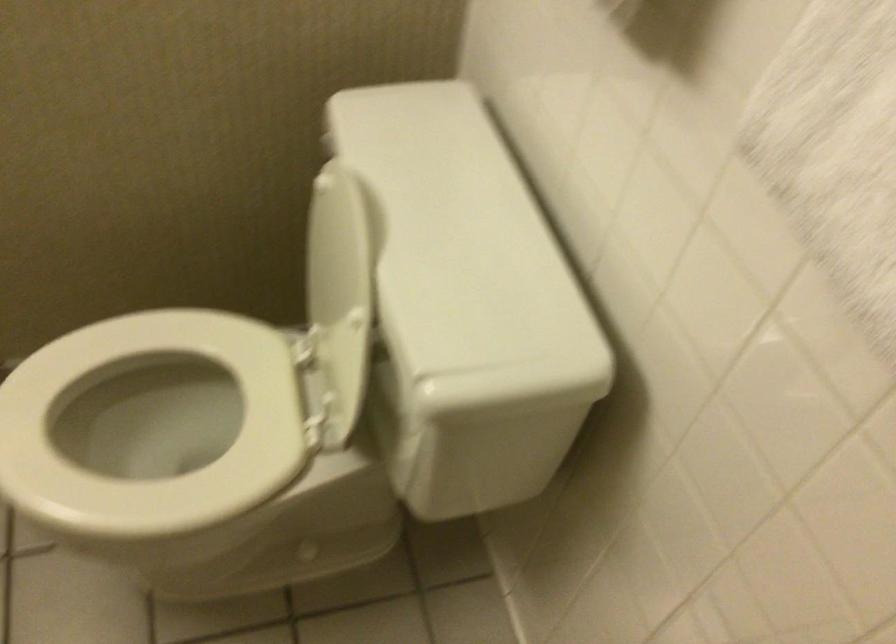
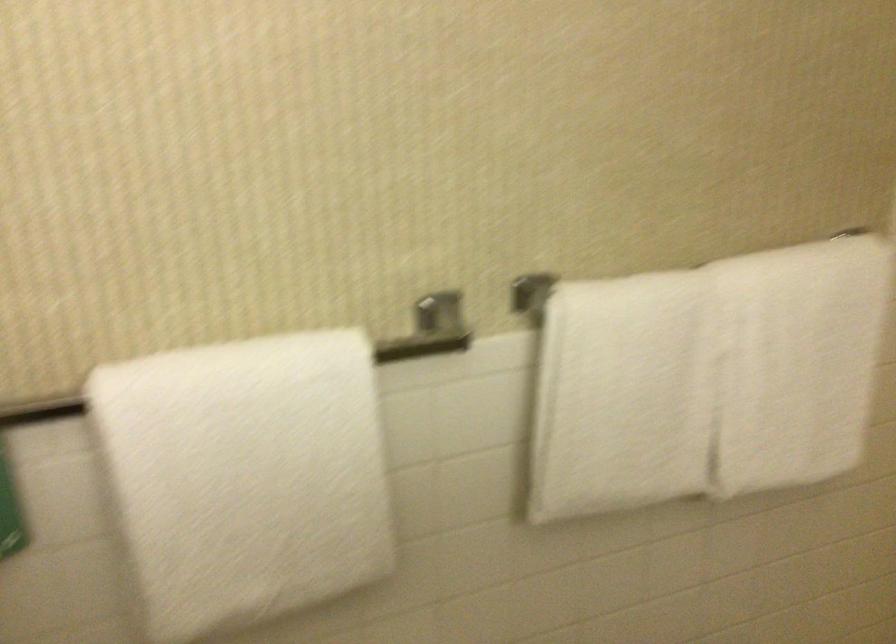
Based on the continuous images, in which direction is the camera rotating?

The camera's rotation is toward right-down.